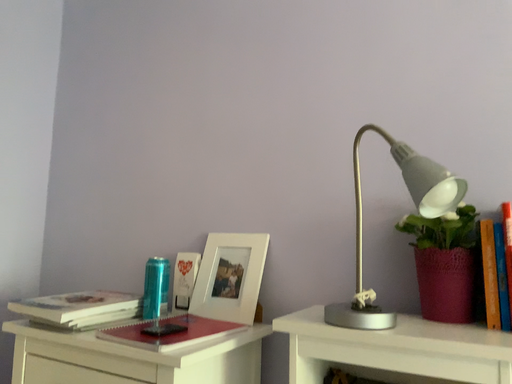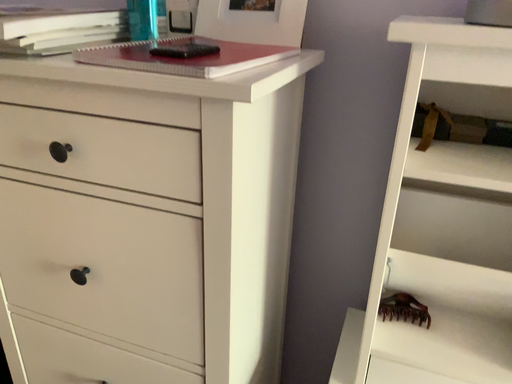
Question: Which way did the camera rotate in the video?

Choices:
 (A) rotated upward
 (B) rotated downward

Answer: (B)